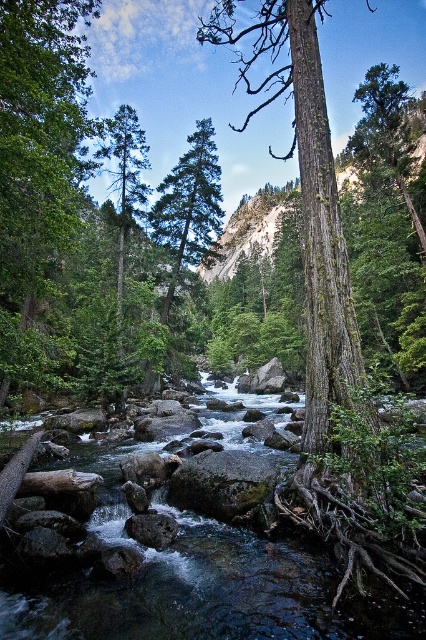
Question: Which of these objects is positioned closest to the green matte tree at center?

Choices:
 (A) green mossy rock at center
 (B) green mossy tree at center
 (C) gray smooth rock at center

Answer: (A)

Question: Based on their relative distances, which object is farther from the green mossy rock at center?

Choices:
 (A) green matte tree at center
 (B) gray smooth rock at center

Answer: (A)

Question: Which object is farther from the camera taking this photo?

Choices:
 (A) green matte tree at center
 (B) green mossy tree at center
 (C) green mossy rock at center

Answer: (A)

Question: Observing the image, what is the correct spatial positioning of green matte tree at center in reference to gray smooth rock at center?

Choices:
 (A) above
 (B) below

Answer: (A)

Question: Does green mossy tree at center come behind green matte tree at center?

Choices:
 (A) yes
 (B) no

Answer: (B)

Question: Can you confirm if green matte tree at center is positioned to the right of green mossy rock at center?

Choices:
 (A) no
 (B) yes

Answer: (A)